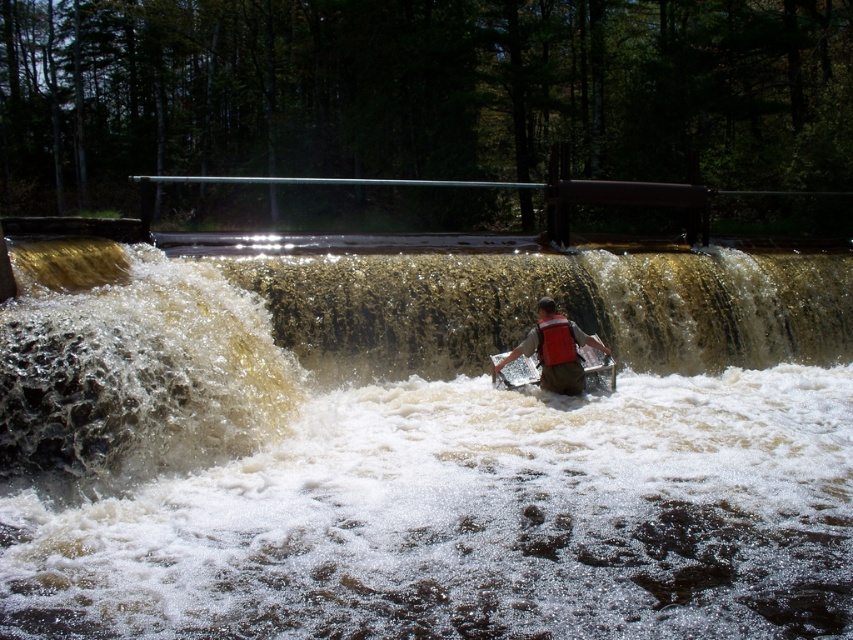
Does brown textured water at center have a smaller size compared to orange life vest at center?

Incorrect, brown textured water at center is not smaller in size than orange life vest at center.

Identify the location of brown textured water at center. Image resolution: width=853 pixels, height=640 pixels. (396, 486).